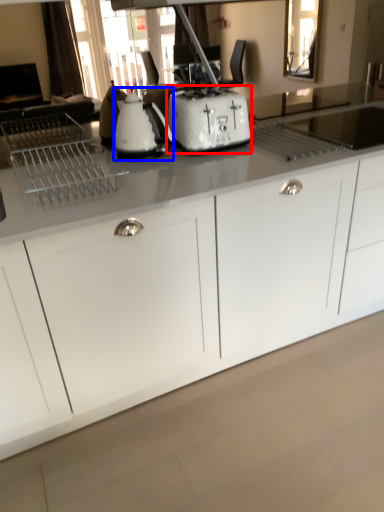
Question: Which object is closer to the camera taking this photo, toaster (highlighted by a red box) or kitchen appliance (highlighted by a blue box)?

Choices:
 (A) toaster
 (B) kitchen appliance

Answer: (B)